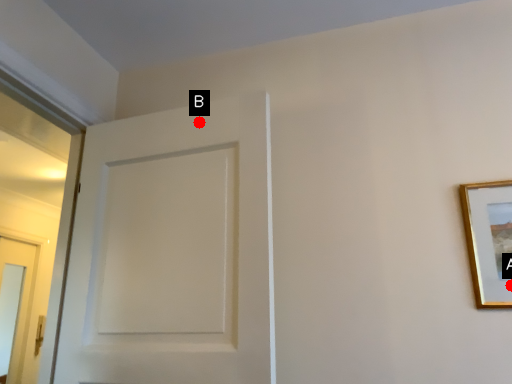
Question: Two points are circled on the image, labeled by A and B beside each circle. Which point appears farthest from the camera in this image?

Choices:
 (A) A is further
 (B) B is further

Answer: (B)